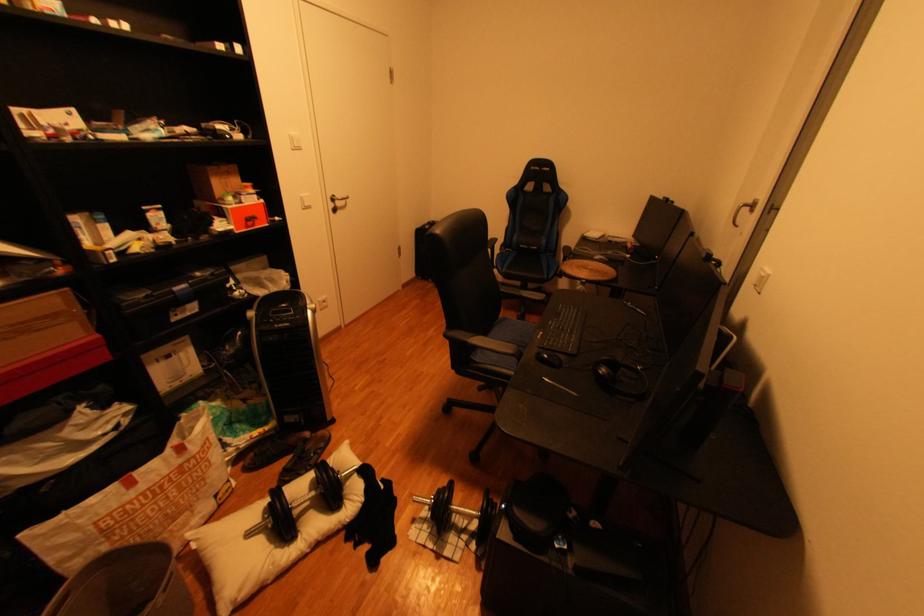
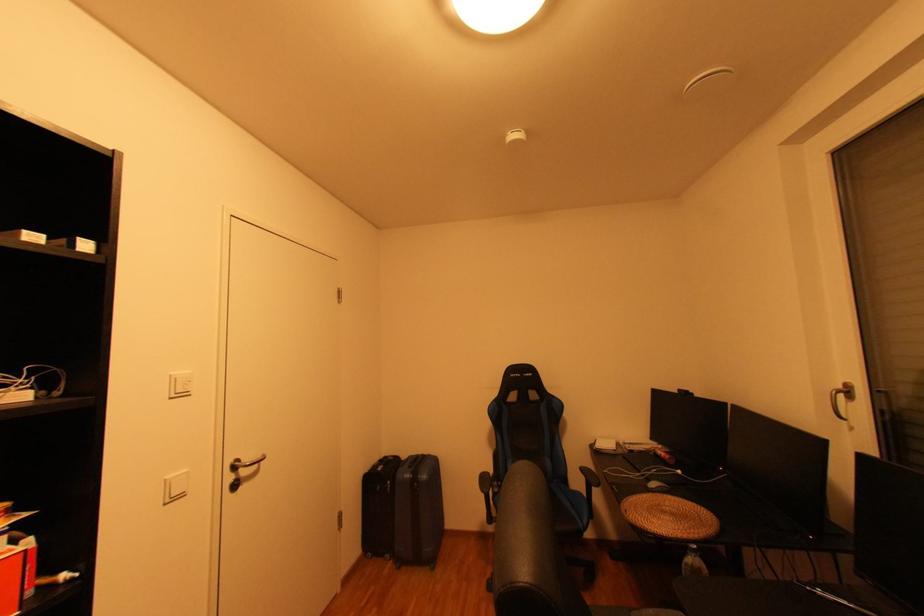
Where in the second image is the point corresponding to [442,284] from the first image?

(400, 562)